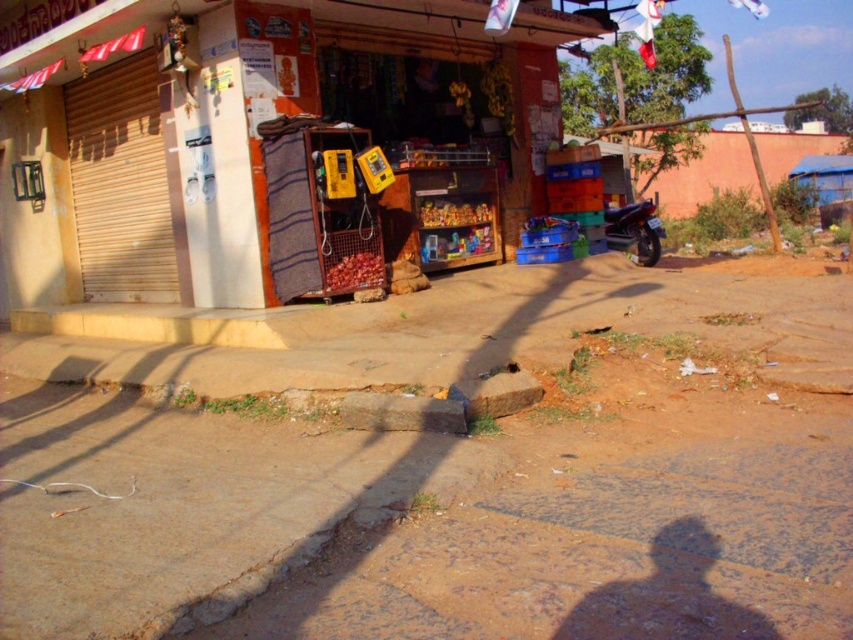
Does dull concrete pavement at center have a lesser height compared to wooden crates at center?

Yes.

Locate an element on the screen. This screenshot has height=640, width=853. dull concrete pavement at center is located at coordinates coord(445,472).

Which is in front, point (747, 432) or point (646, 209)?

Positioned in front is point (747, 432).

Which is behind, point (392, 444) or point (625, 244)?

Positioned behind is point (625, 244).

From the picture: Who is more distant from viewer, (x=309, y=432) or (x=621, y=230)?

The point (x=621, y=230) is more distant.

This screenshot has height=640, width=853. In order to click on dull concrete pavement at center in this screenshot , I will do `click(445, 472)`.

Is metallic blue motorcycle at right shorter than yellow plastic phone box at center?

In fact, metallic blue motorcycle at right may be taller than yellow plastic phone box at center.

Is metallic blue motorcycle at right smaller than yellow plastic phone box at center?

Actually, metallic blue motorcycle at right might be larger than yellow plastic phone box at center.

Is point (608, 227) farther from camera compared to point (345, 156)?

Yes, it is behind point (345, 156).

This screenshot has height=640, width=853. I want to click on metallic blue motorcycle at right, so click(634, 228).